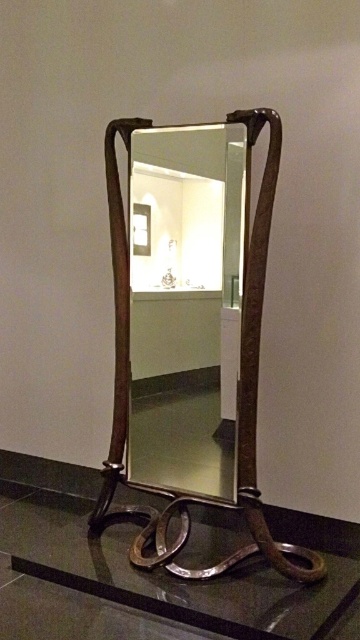
Question: Which of the following is the farthest from the observer?

Choices:
 (A) transparent glass table at lower center
 (B) polished wood mirror at center

Answer: (B)

Question: Among these objects, which one is nearest to the camera?

Choices:
 (A) polished wood mirror at center
 (B) transparent glass table at lower center

Answer: (B)

Question: Is polished wood mirror at center to the right of transparent glass table at lower center from the viewer's perspective?

Choices:
 (A) no
 (B) yes

Answer: (B)

Question: Which point is farther to the camera?

Choices:
 (A) polished wood mirror at center
 (B) transparent glass table at lower center

Answer: (A)

Question: Is polished wood mirror at center above transparent glass table at lower center?

Choices:
 (A) yes
 (B) no

Answer: (A)

Question: Does polished wood mirror at center appear on the left side of transparent glass table at lower center?

Choices:
 (A) yes
 (B) no

Answer: (B)